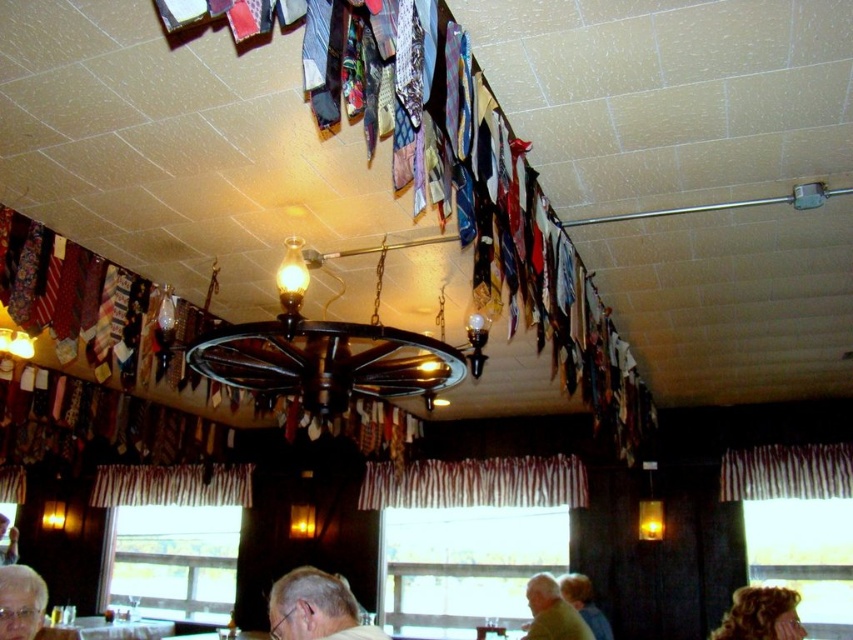
Question: Can you confirm if white striped fabric at lower center is positioned to the left of curly blonde hair at upper center?

Choices:
 (A) yes
 (B) no

Answer: (A)

Question: Which of the following is the farthest from the observer?

Choices:
 (A) (10, 538)
 (B) (350, 604)

Answer: (A)

Question: Which is farther from the curly blonde hair at upper center?

Choices:
 (A) light brown hair at lower right
 (B) striped fabric curtain at lower center
 (C) white striped fabric at lower center

Answer: (B)

Question: Observing the image, what is the correct spatial positioning of green fabric shirt at lower right in reference to smooth skin face at lower left?

Choices:
 (A) left
 (B) right

Answer: (B)

Question: Based on their relative distances, which object is nearer to the white matte hair at lower center?

Choices:
 (A) striped fabric curtain at lower center
 (B) striped fabric curtain at lower right

Answer: (B)

Question: Can you confirm if white striped fabric at lower center is positioned above light brown hair at lower right?

Choices:
 (A) yes
 (B) no

Answer: (A)